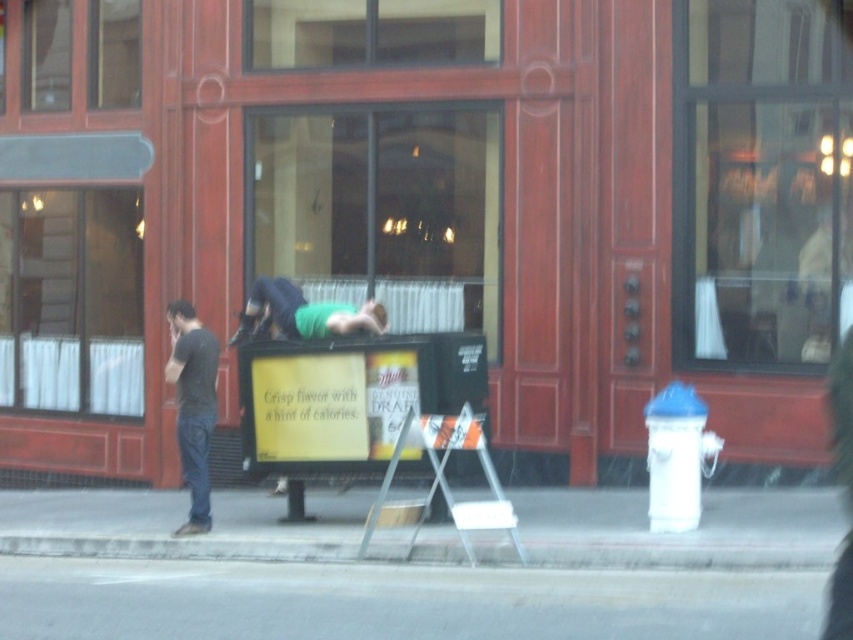
Does gray asphalt at lower center appear under green matte shirt at center?

Correct, gray asphalt at lower center is located below green matte shirt at center.

Does gray asphalt at lower center have a greater height compared to green matte shirt at center?

No.

Is point (519, 634) positioned before point (265, 308)?

Yes, point (519, 634) is closer to viewer.

Identify the location of gray asphalt at lower center. The width and height of the screenshot is (853, 640). (395, 602).

Between gray concrete curb at lower center and black cotton shirt at left, which one is positioned lower?

gray concrete curb at lower center

Who is more distant from viewer, (x=460, y=560) or (x=206, y=497)?

The point (x=206, y=497) is more distant.

Describe the element at coordinates (175, 547) in the screenshot. I see `gray concrete curb at lower center` at that location.

Where is `gray concrete curb at lower center`? The height and width of the screenshot is (640, 853). gray concrete curb at lower center is located at coordinates (175, 547).

Who is shorter, gray asphalt at lower center or black cotton shirt at left?

gray asphalt at lower center

Does point (225, 598) lie in front of point (206, 362)?

Yes, point (225, 598) is closer to viewer.

Is point (106, 632) closer to camera compared to point (192, 364)?

Yes, point (106, 632) is closer to viewer.

At what (x,y) coordinates should I click in order to perform the action: click on gray asphalt at lower center. Please return your answer as a coordinate pair (x, y). Looking at the image, I should click on (395, 602).